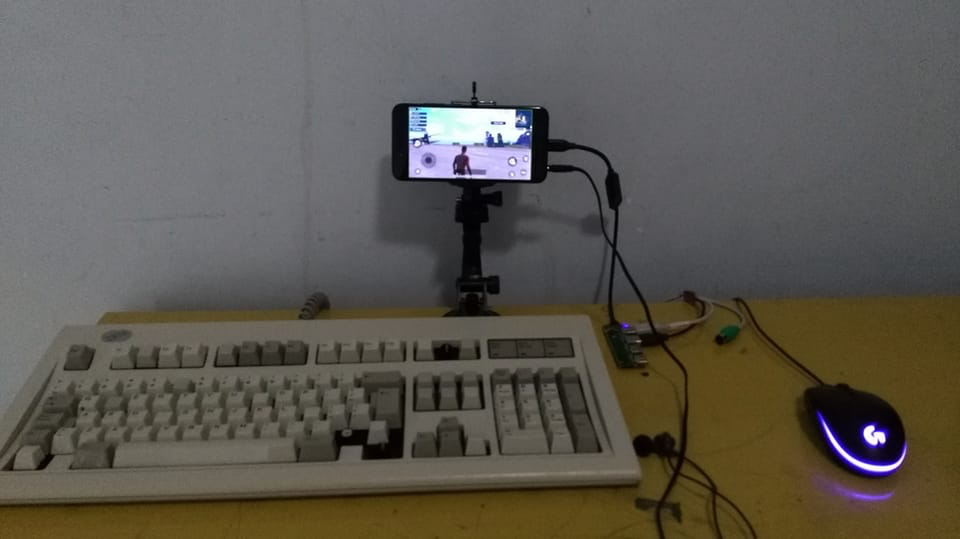
Where is `keyboard`? Image resolution: width=960 pixels, height=539 pixels. keyboard is located at coordinates (354, 367).